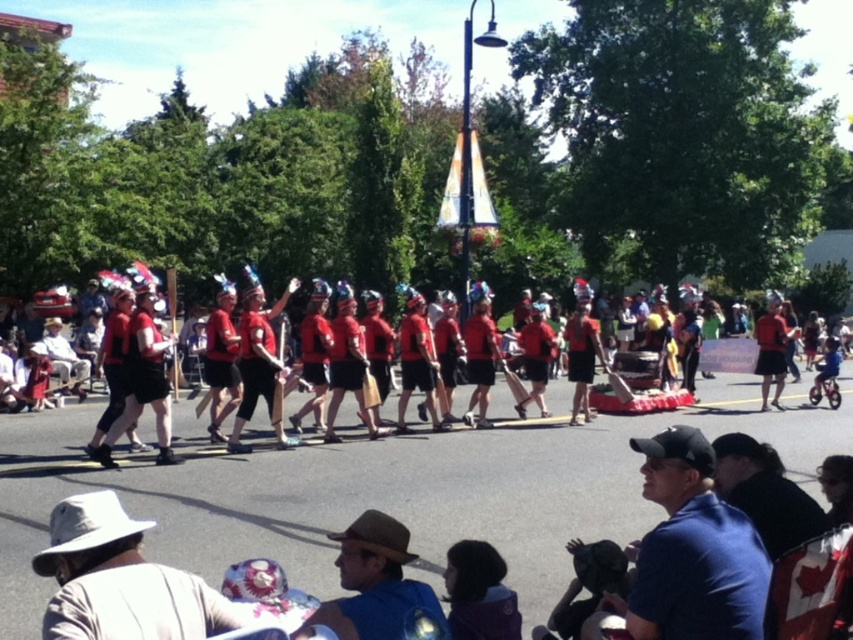
Question: Does shiny metallic helmet at center appear on the left side of matte red shorts at center?

Choices:
 (A) no
 (B) yes

Answer: (B)

Question: Among these objects, which one is nearest to the camera?

Choices:
 (A) blue cotton shirt at lower right
 (B) matte red uniform at center
 (C) red matte uniform at center
 (D) shiny metallic helmet at center

Answer: (A)

Question: Which point is closer to the camera?

Choices:
 (A) blue cotton shirt at lower right
 (B) red matte uniform at center

Answer: (A)

Question: Can you confirm if blue cotton shirt at lower right is positioned above shiny metallic helmet at center?

Choices:
 (A) yes
 (B) no

Answer: (B)

Question: Which point is closer to the camera?

Choices:
 (A) (305, 476)
 (B) (364, 568)
 (C) (677, 451)

Answer: (C)

Question: Is shiny metallic helmet at center bigger than matte red uniform at center?

Choices:
 (A) yes
 (B) no

Answer: (B)